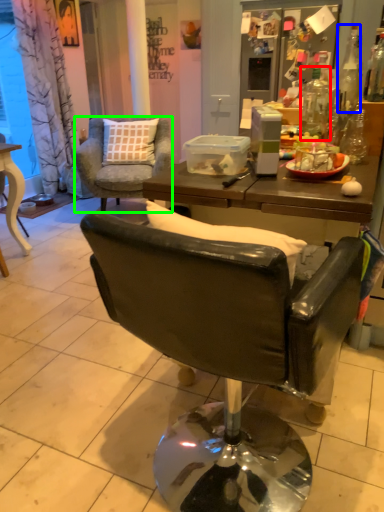
Question: Based on their relative distances, which object is farther from bottle (highlighted by a red box)? Choose from bottle (highlighted by a blue box) and chair (highlighted by a green box).

Choices:
 (A) bottle
 (B) chair

Answer: (A)